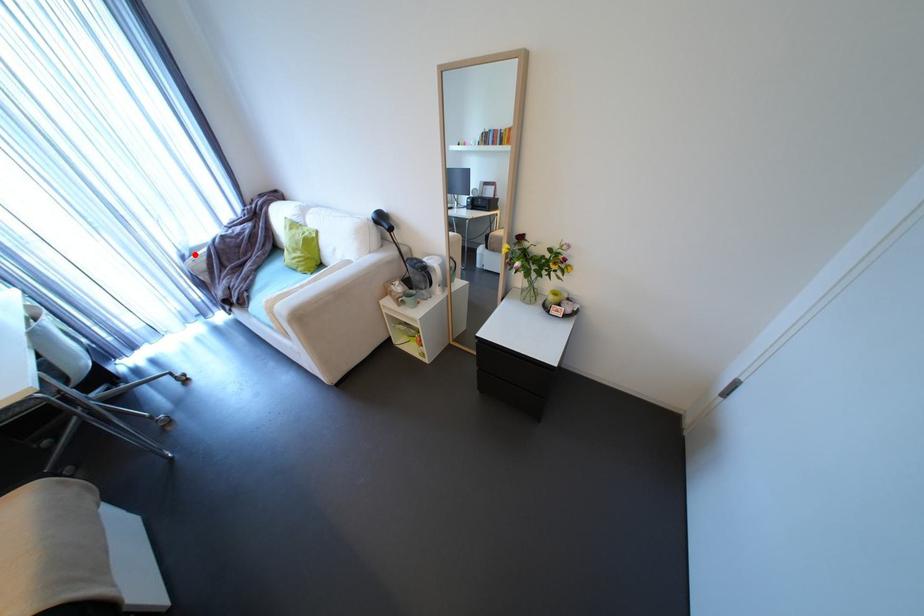
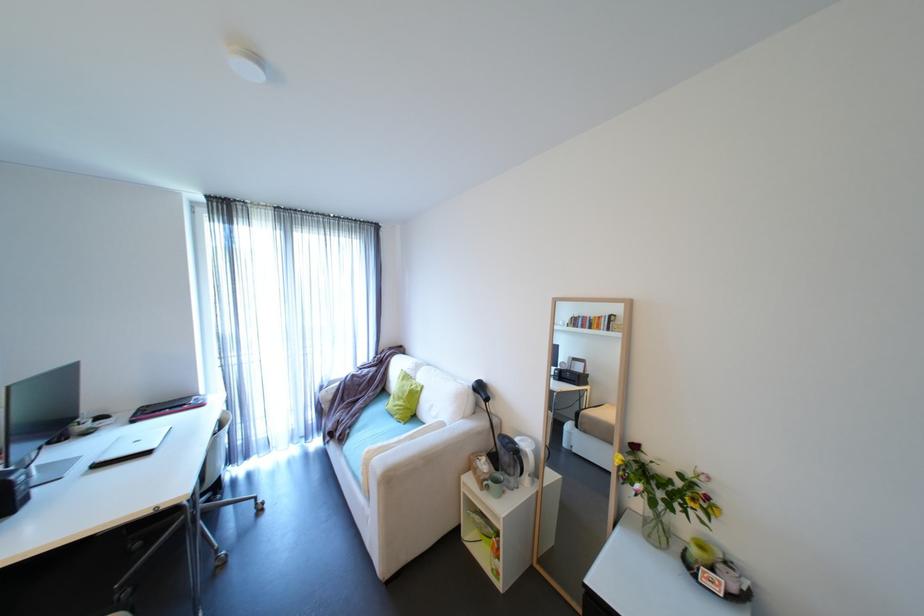
Question: I am providing you with two images of the same scene from different viewpoints. A red point is marked on the first image. Can you still see the location of the red point in image 2?

Choices:
 (A) Yes
 (B) No

Answer: (A)